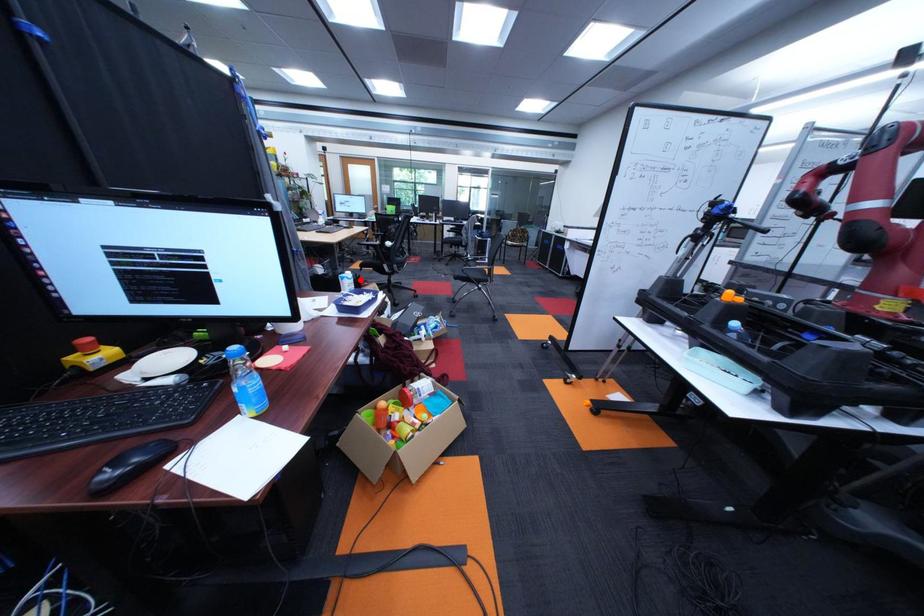
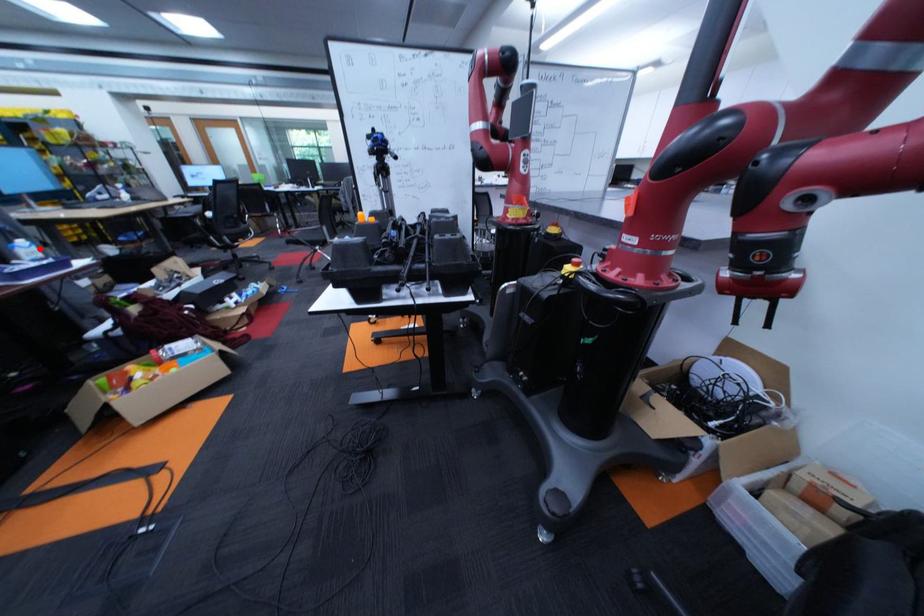
I am providing you with two images of the same scene from different viewpoints. A red point is marked on the first image and another point is marked on the second image. Is the marked point in image1 the same physical position as the marked point in image2?

Yes